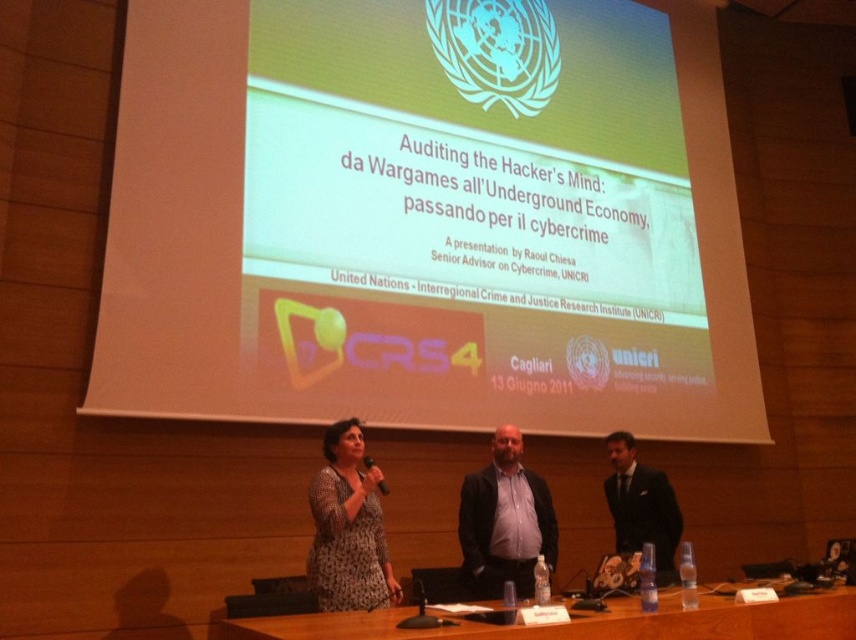
Who is more forward, (833,600) or (339,556)?

Point (833,600) is more forward.

In the scene shown: Between wooden table at center and printed fabric dress at center, which one has more height?

printed fabric dress at center is taller.

Is point (553, 628) farther from viewer compared to point (336, 532)?

That is False.

You are a GUI agent. You are given a task and a screenshot of the screen. Output one action in this format:
    pyautogui.click(x=<x>, y=<y>)
    Task: Click on the wooden table at center
    The image size is (856, 640).
    Given the screenshot: What is the action you would take?
    coord(592,621)

Does printed fabric dress at center have a lesser height compared to dark suit at center?

No.

Who is lower down, printed fabric dress at center or dark suit at center?

dark suit at center

The image size is (856, 640). Describe the element at coordinates (348, 528) in the screenshot. I see `printed fabric dress at center` at that location.

The height and width of the screenshot is (640, 856). I want to click on printed fabric dress at center, so click(x=348, y=528).

Is point (551, 532) positioned after point (669, 525)?

No, (551, 532) is in front of (669, 525).

In the scene shown: Between matte black jacket at center and dark suit at center, which one has less height?

With less height is dark suit at center.

Is point (531, 557) more distant than point (623, 451)?

That is False.

You are a GUI agent. You are given a task and a screenshot of the screen. Output one action in this format:
    pyautogui.click(x=<x>, y=<y>)
    Task: Click on the matte black jacket at center
    
    Given the screenshot: What is the action you would take?
    pyautogui.click(x=504, y=520)